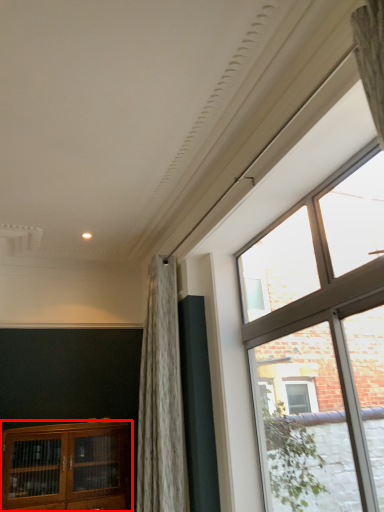
Question: From the image's perspective, considering the relative positions of cabinetry (annotated by the red box) and window in the image provided, where is cabinetry (annotated by the red box) located with respect to the staircase?

Choices:
 (A) above
 (B) below

Answer: (B)